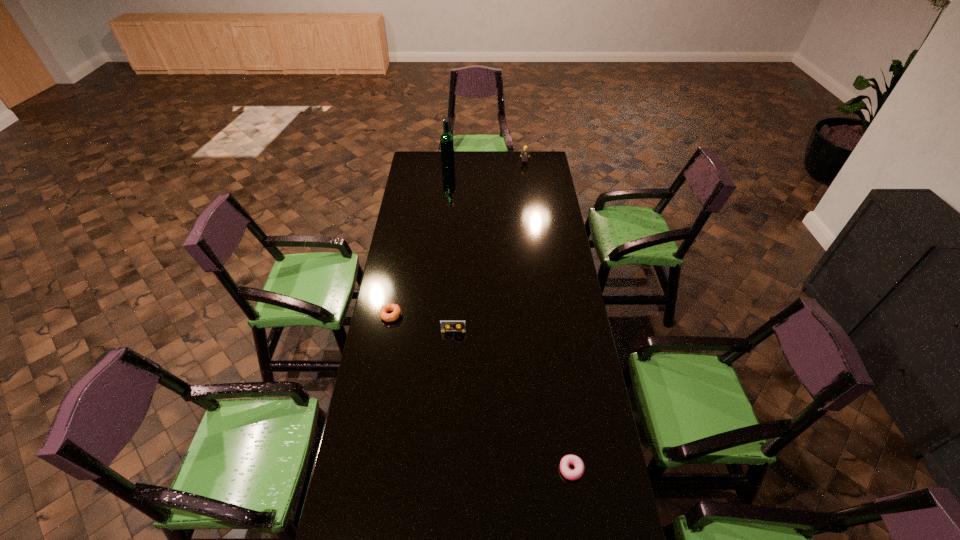
The width and height of the screenshot is (960, 540). In order to click on vacant region located 0.270m at the front of the videotape with visible reels in this screenshot , I will do `click(450, 392)`.

Find the location of a particular element. Image resolution: width=960 pixels, height=540 pixels. vacant space located on the front of the leftmost object is located at coordinates (386, 345).

You are a GUI agent. You are given a task and a screenshot of the screen. Output one action in this format:
    pyautogui.click(x=<x>, y=<y>)
    Task: Click on the vacant space situated on the left of the shortest object
    The height and width of the screenshot is (540, 960).
    Given the screenshot: What is the action you would take?
    (x=525, y=469)

This screenshot has height=540, width=960. I want to click on beer bottle that is at the far edge, so click(x=446, y=139).

Where is `Lego that is at the far edge`? The image size is (960, 540). Lego that is at the far edge is located at coordinates (524, 153).

The image size is (960, 540). I want to click on object positioned at the left edge, so click(x=383, y=312).

This screenshot has width=960, height=540. I want to click on Lego that is at the right edge, so click(524, 153).

Where is `doughnut that is at the right edge`? doughnut that is at the right edge is located at coordinates (566, 461).

At what (x,y) coordinates should I click in order to perform the action: click on object situated at the far right corner. Please return your answer as a coordinate pair (x, y). This screenshot has height=540, width=960. Looking at the image, I should click on (524, 153).

The height and width of the screenshot is (540, 960). In the image, there is a desktop. Find the location of `vacant area at the far edge`. vacant area at the far edge is located at coordinates (493, 163).